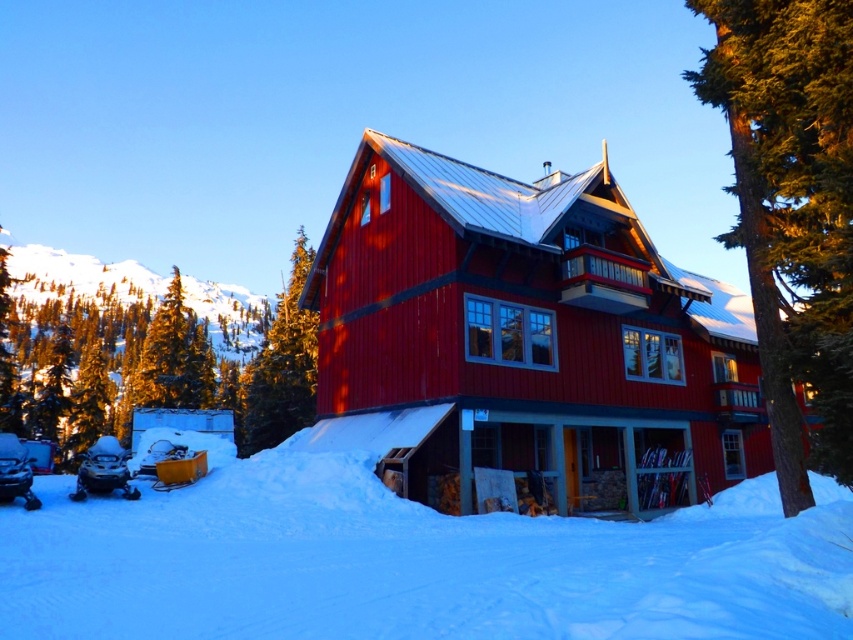
Question: Which object is closer to the camera taking this photo?

Choices:
 (A) matte red cabin at center
 (B) green textured tree at center

Answer: (B)

Question: Does white powdery snow at lower center have a lesser width compared to green textured pine tree at upper center?

Choices:
 (A) no
 (B) yes

Answer: (B)

Question: Is white powdery snow at lower center positioned at the back of green textured tree at center?

Choices:
 (A) no
 (B) yes

Answer: (A)

Question: Does white powdery snow at lower center have a larger size compared to green textured pine tree at upper center?

Choices:
 (A) yes
 (B) no

Answer: (B)

Question: Which point is closer to the camera?

Choices:
 (A) (248, 381)
 (B) (805, 134)
 (C) (341, 404)

Answer: (B)

Question: Which point is farther from the camera taking this photo?

Choices:
 (A) (788, 602)
 (B) (793, 38)
 (C) (654, 339)

Answer: (C)